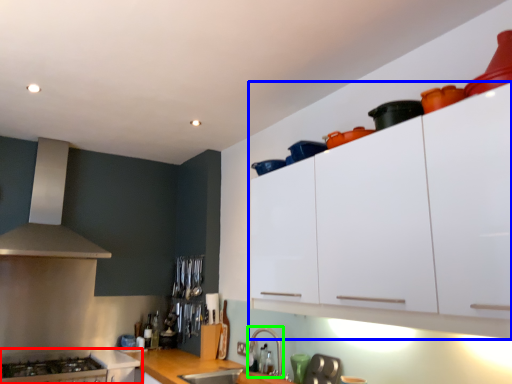
Question: Based on their relative distances, which object is farther from cabinetry (highlighted by a red box)? Choose from cabinetry (highlighted by a blue box) and faucet (highlighted by a green box).

Choices:
 (A) cabinetry
 (B) faucet

Answer: (A)